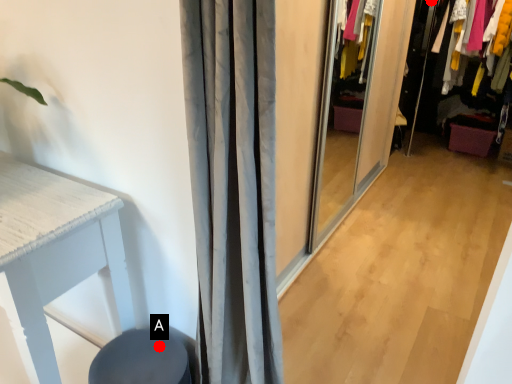
Question: Two points are circled on the image, labeled by A and B beside each circle. Which point appears farthest from the camera in this image?

Choices:
 (A) A is further
 (B) B is further

Answer: (B)